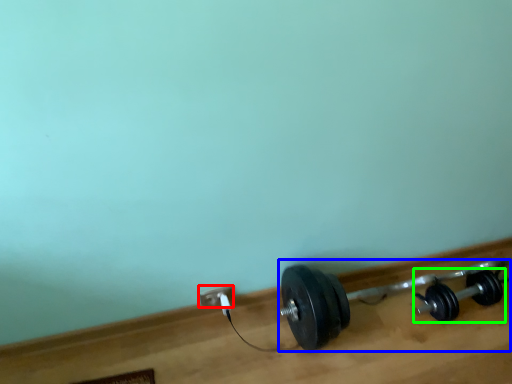
Question: Based on their relative distances, which object is farther from power plugs and sockets (highlighted by a red box)? Choose from dumbbell (highlighted by a blue box) and dumbbell (highlighted by a green box).

Choices:
 (A) dumbbell
 (B) dumbbell

Answer: (B)